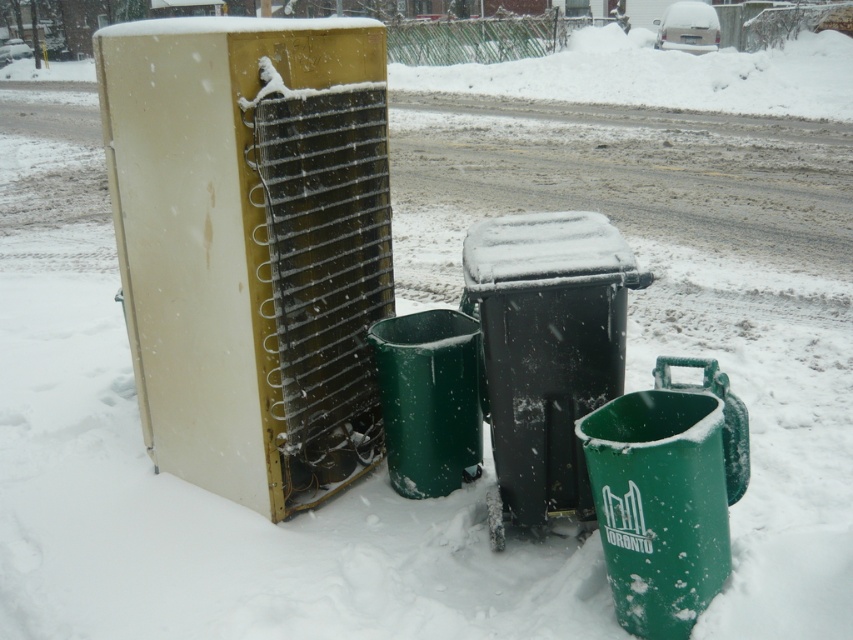
You are a waste collector in Toronto who needs to determine which green plastic bin is bigger. You see the green plastic bin at lower right and the green plastic bin at center. Which one is bigger?

The green plastic bin at lower right is larger in size than the green plastic bin at center, so the one at lower right is bigger.

You are moving the black plastic bin at center and the green plastic bin at lower right. Which one requires more effort to lift?

The black plastic bin at center requires more effort to lift because it is bigger than the green plastic bin at lower right.